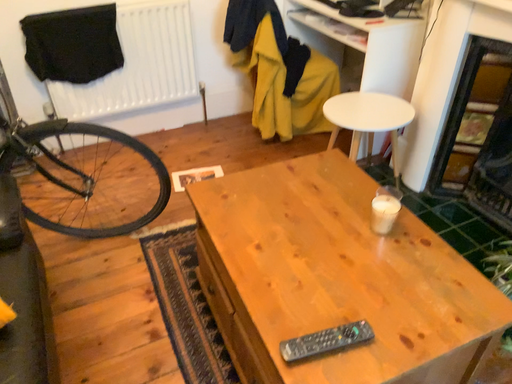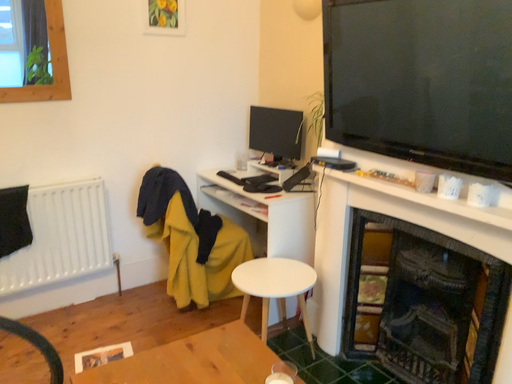
Question: Which way did the camera rotate in the video?

Choices:
 (A) rotated right
 (B) rotated left

Answer: (A)